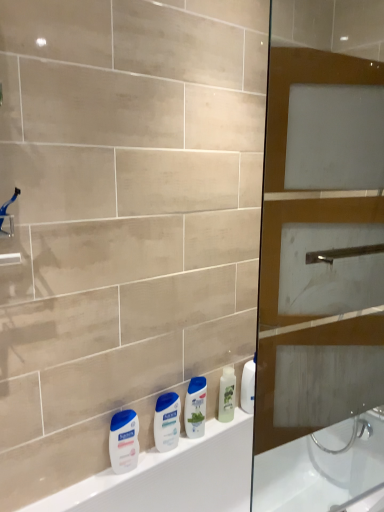
Question: Which direction should I rotate to look at white glossy lotion at center, marked as the 2th toiletry in a front-to-back arrangement, — up or down?

Choices:
 (A) up
 (B) down

Answer: (B)

Question: Is blue glossy shampoo at center bigger than white matte lotion at lower left, which ranks as the first toiletry in front-to-back order?

Choices:
 (A) no
 (B) yes

Answer: (B)

Question: Can white matte lotion at lower left, which ranks as the 1th toiletry in left-to-right order, be found inside blue glossy shampoo at center?

Choices:
 (A) yes
 (B) no

Answer: (B)

Question: Is blue glossy shampoo at center oriented away from white matte lotion at lower left, the third toiletry when ordered from back to front?

Choices:
 (A) yes
 (B) no

Answer: (B)

Question: From a real-world perspective, is blue glossy shampoo at center located beneath white matte lotion at lower left, which ranks as the 1th toiletry in left-to-right order?

Choices:
 (A) no
 (B) yes

Answer: (A)

Question: Is blue glossy shampoo at center behind white matte lotion at lower left, which ranks as the 1th toiletry in left-to-right order?

Choices:
 (A) no
 (B) yes

Answer: (B)

Question: Does blue glossy shampoo at center have a smaller size compared to white matte lotion at lower left, which ranks as the first toiletry in front-to-back order?

Choices:
 (A) yes
 (B) no

Answer: (B)

Question: Considering the relative sizes of white glossy lotion at center, which is the first toiletry from right to left, and white matte lotion at lower left, which ranks as the first toiletry in front-to-back order, in the image provided, is white glossy lotion at center, which is the first toiletry from right to left, bigger than white matte lotion at lower left, which ranks as the first toiletry in front-to-back order,?

Choices:
 (A) yes
 (B) no

Answer: (B)

Question: From the image's perspective, is white glossy lotion at center, the first toiletry viewed from the back, on white matte lotion at lower left, which ranks as the first toiletry in front-to-back order?

Choices:
 (A) no
 (B) yes

Answer: (B)

Question: From the image's perspective, does white glossy lotion at center, the first toiletry viewed from the back, appear lower than white matte lotion at lower left, which ranks as the 1th toiletry in left-to-right order?

Choices:
 (A) yes
 (B) no

Answer: (B)

Question: Considering the relative sizes of white glossy lotion at center, which is the third toiletry from left to right, and white matte lotion at lower left, which ranks as the 1th toiletry in left-to-right order, in the image provided, is white glossy lotion at center, which is the third toiletry from left to right, taller than white matte lotion at lower left, which ranks as the 1th toiletry in left-to-right order,?

Choices:
 (A) yes
 (B) no

Answer: (A)

Question: Is white glossy lotion at center, which is the third toiletry in front-to-back order, oriented towards white matte lotion at lower left, the third toiletry when ordered from back to front?

Choices:
 (A) yes
 (B) no

Answer: (B)

Question: Can you confirm if white glossy lotion at center, which is the third toiletry in front-to-back order, is positioned to the right of white matte lotion at lower left, the 3th toiletry positioned from the right?

Choices:
 (A) no
 (B) yes

Answer: (B)

Question: Considering the relative positions of white glossy lotion at center, marked as the 2th toiletry in a front-to-back arrangement, and blue plastic shower head at upper left in the image provided, is white glossy lotion at center, marked as the 2th toiletry in a front-to-back arrangement, in front of blue plastic shower head at upper left?

Choices:
 (A) yes
 (B) no

Answer: (B)